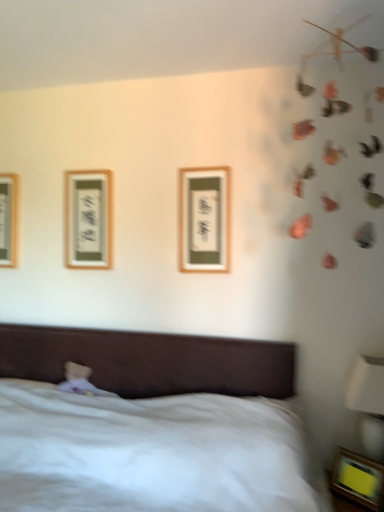
Question: Visually, is white plush bear at lower left positioned to the left or to the right of wooden framed picture at left, the 4th picture frame in the front-to-back sequence?

Choices:
 (A) right
 (B) left

Answer: (A)

Question: In terms of width, does white plush bear at lower left look wider or thinner when compared to wooden framed picture at left, the 4th picture frame in the front-to-back sequence?

Choices:
 (A) thin
 (B) wide

Answer: (B)

Question: Which object is the closest to the wooden framed picture at center, the third picture frame positioned from the top?

Choices:
 (A) wooden picture frame at lower right, marked as the 4th picture frame in a top-to-bottom arrangement
 (B) white glossy bedside lamp at lower right
 (C) wooden framed picture at left, the 4th picture frame in the front-to-back sequence
 (D) white plush bear at lower left
 (E) brown fabric bed at lower left

Answer: (E)

Question: Which is nearer to the brown fabric bed at lower left?

Choices:
 (A) white glossy bedside lamp at lower right
 (B) wooden framed picture at center, which is the second picture frame in right-to-left order
 (C) matte wood picture frame at upper left, placed as the third picture frame when sorted from bottom to top
 (D) white plush bear at lower left
 (E) wooden framed picture at left, the first picture frame in the top-to-bottom sequence

Answer: (D)